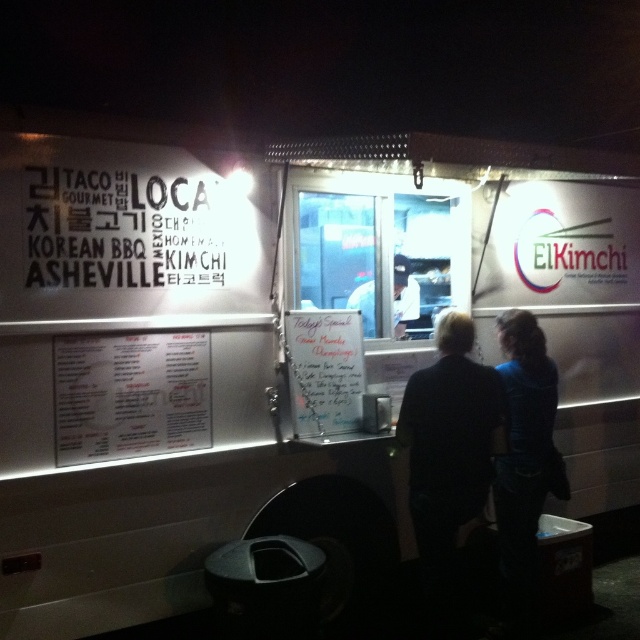
You are a customer looking at the food truck and notice the dark fabric shirt at center and the whiteboard menu at center. Which object is taller?

The dark fabric shirt at center is taller than the whiteboard menu at center.

You are a customer at the food truck and want to choose between the white paper menu at center and the whiteboard menu at center. Which menu is taller?

The whiteboard menu at center is taller than the white paper menu at center.